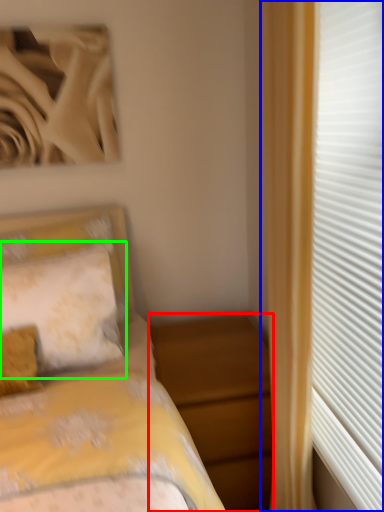
Question: Which object is positioned farthest from nightstand (highlighted by a red box)? Select from curtain (highlighted by a blue box) and pillow (highlighted by a green box).

Choices:
 (A) curtain
 (B) pillow

Answer: (A)